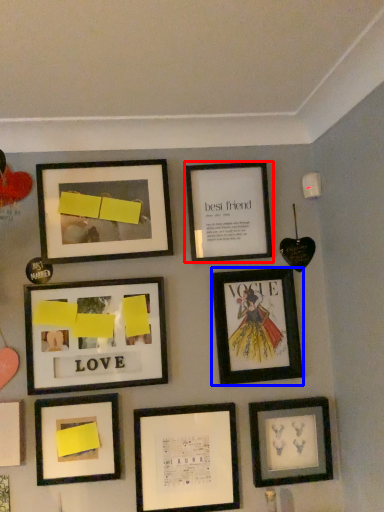
Question: Which object is closer to the camera taking this photo, picture frame (highlighted by a red box) or picture frame (highlighted by a blue box)?

Choices:
 (A) picture frame
 (B) picture frame

Answer: (B)